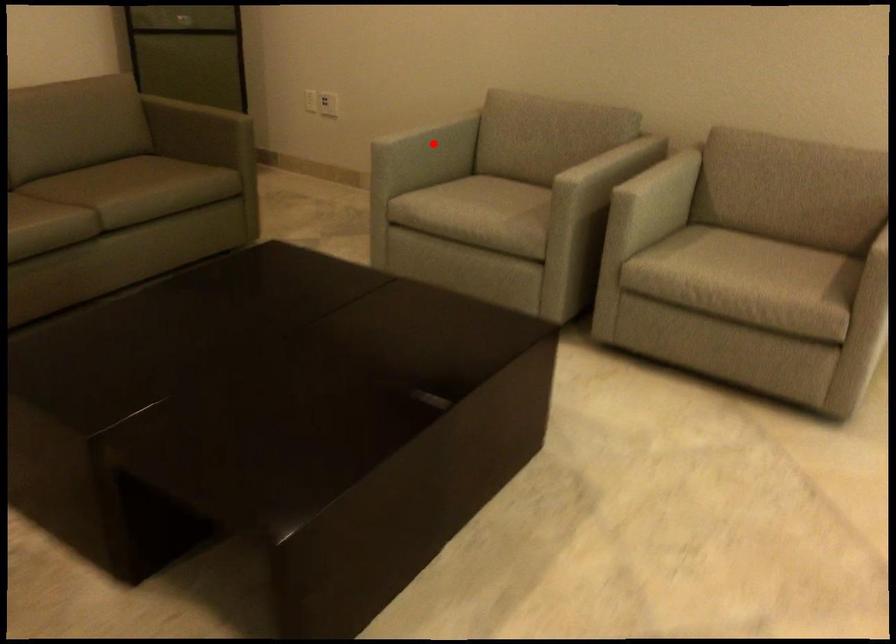
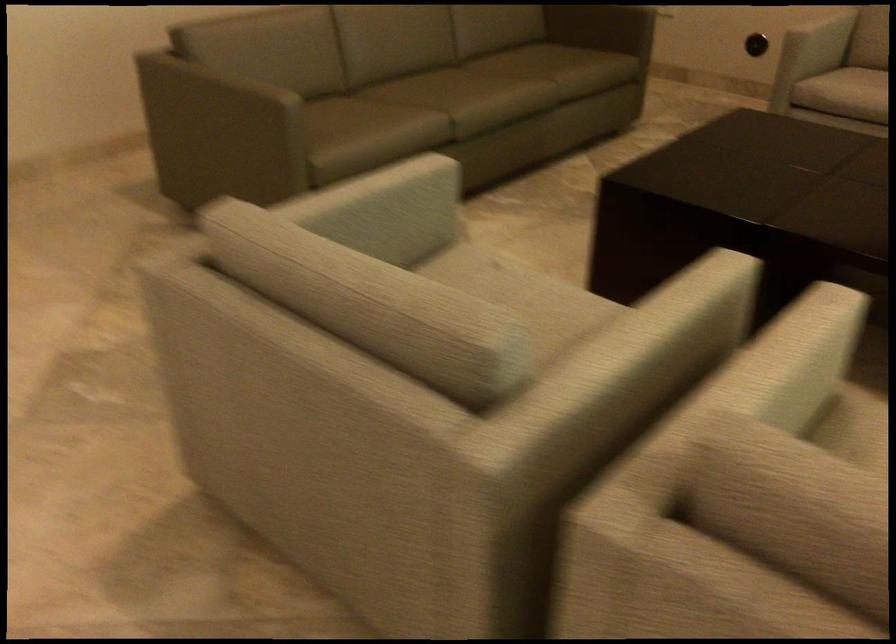
The point at the highlighted location is marked in the first image. Where is the corresponding point in the second image?

(821, 35)